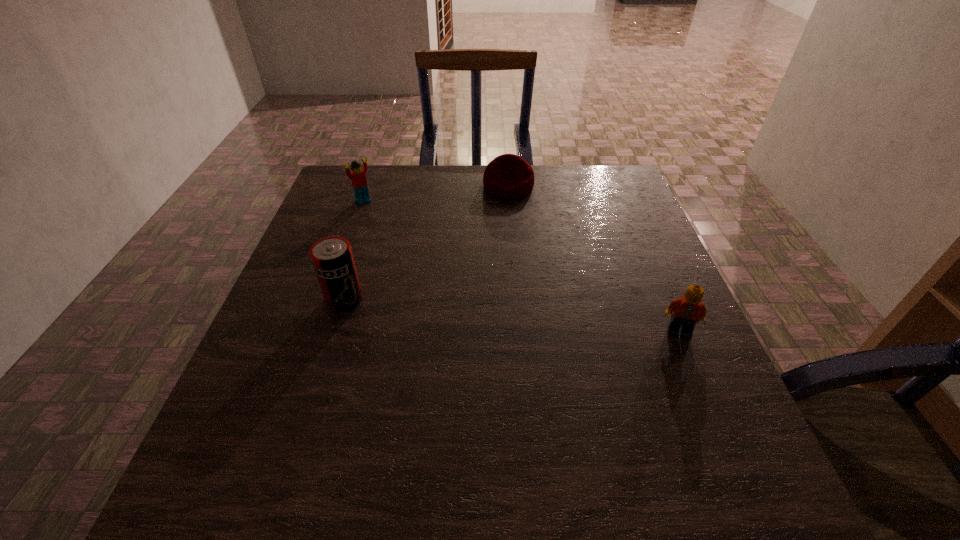
Identify the location of vacant space on the desktop that is between the tallest object and the nearer Lego and is positioned on the face of the farther Lego. (485, 313).

You are a GUI agent. You are given a task and a screenshot of the screen. Output one action in this format:
    pyautogui.click(x=<x>, y=<y>)
    Task: Click on the free space on the desktop that is between the can and the nearest object and is positioned on the seat area of the third object from left to right
    Image resolution: width=960 pixels, height=540 pixels.
    Given the screenshot: What is the action you would take?
    pyautogui.click(x=517, y=316)